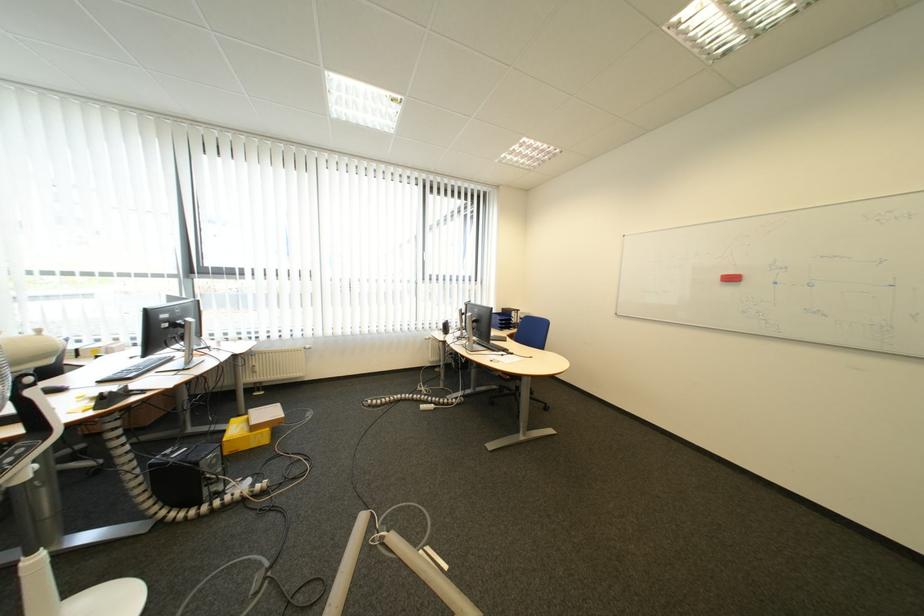
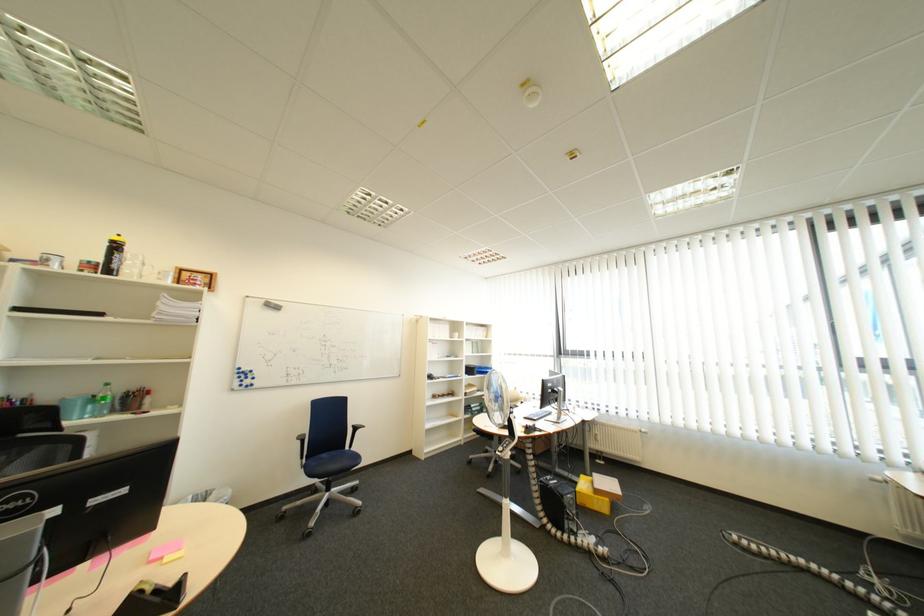
Find the pixel in the second image that matches (x=226, y=463) in the first image.

(585, 503)